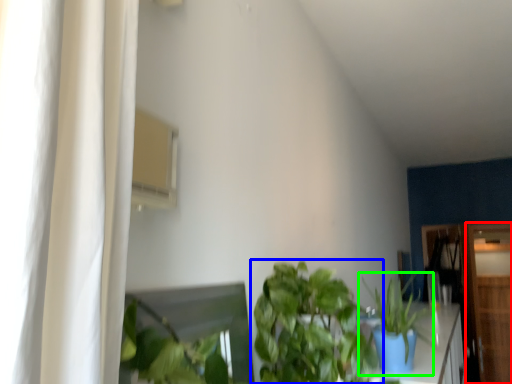
Question: Estimate the real-world distances between objects in this image. Which object is farther from dresser (highlighted by a red box), houseplant (highlighted by a blue box) or houseplant (highlighted by a green box)?

Choices:
 (A) houseplant
 (B) houseplant

Answer: (A)